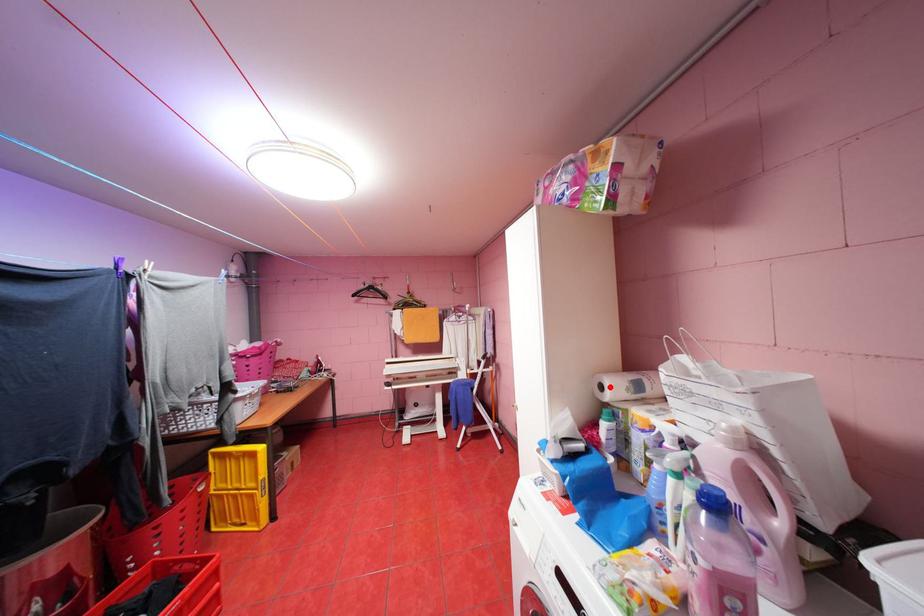
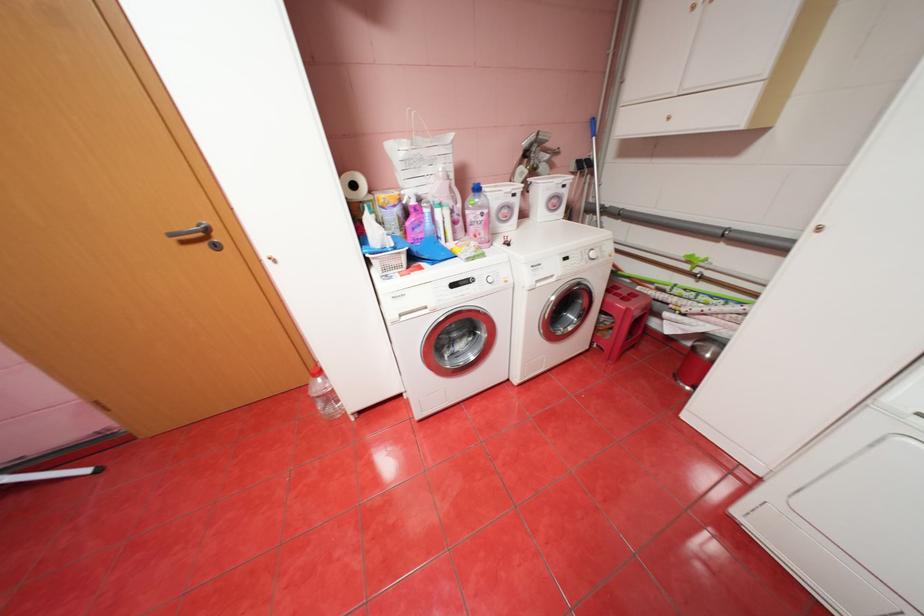
In the second image, find the point that corresponds to the highlighted location in the first image.

(362, 185)